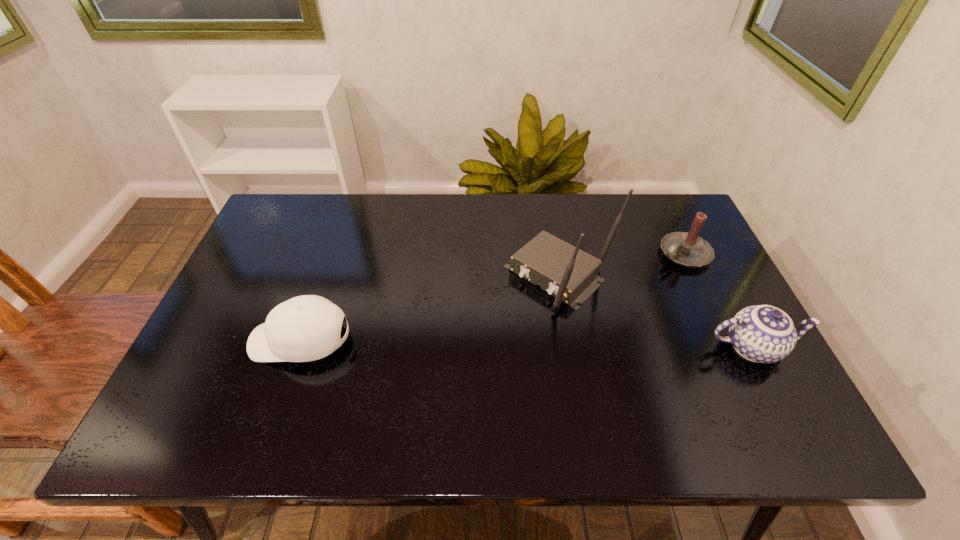
Where is `object located at the near left corner`? object located at the near left corner is located at coordinates (305, 328).

The width and height of the screenshot is (960, 540). Find the location of `object that is at the far right corner`. object that is at the far right corner is located at coordinates (688, 249).

Image resolution: width=960 pixels, height=540 pixels. What are the coordinates of `object positioned at the near right corner` in the screenshot? It's located at (761, 333).

Identify the location of free space at the far edge of the desktop. (378, 207).

Locate an element on the screen. vacant space at the near edge is located at coordinates (692, 373).

Where is `free point at the left edge`? Image resolution: width=960 pixels, height=540 pixels. free point at the left edge is located at coordinates (274, 260).

The height and width of the screenshot is (540, 960). I want to click on blank space at the right edge of the desktop, so click(x=709, y=334).

Where is `free location at the far left corner of the desktop`? The image size is (960, 540). free location at the far left corner of the desktop is located at coordinates 304,226.

You are a GUI agent. You are given a task and a screenshot of the screen. Output one action in this format:
    pyautogui.click(x=<x>, y=<y>)
    Task: Click on the vacant region at the near left corner
    
    Given the screenshot: What is the action you would take?
    [243, 400]

This screenshot has height=540, width=960. I want to click on blank space at the far right corner of the desktop, so click(x=648, y=204).